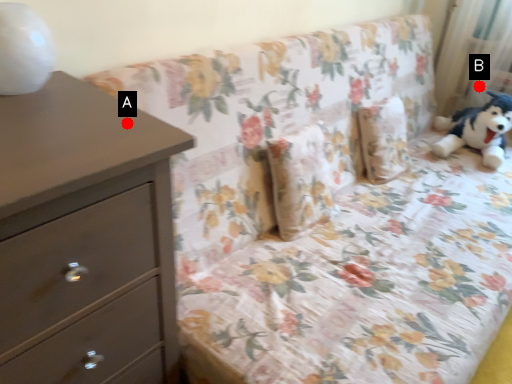
Question: Two points are circled on the image, labeled by A and B beside each circle. Among these points, which one is nearest to the camera?

Choices:
 (A) A is closer
 (B) B is closer

Answer: (A)